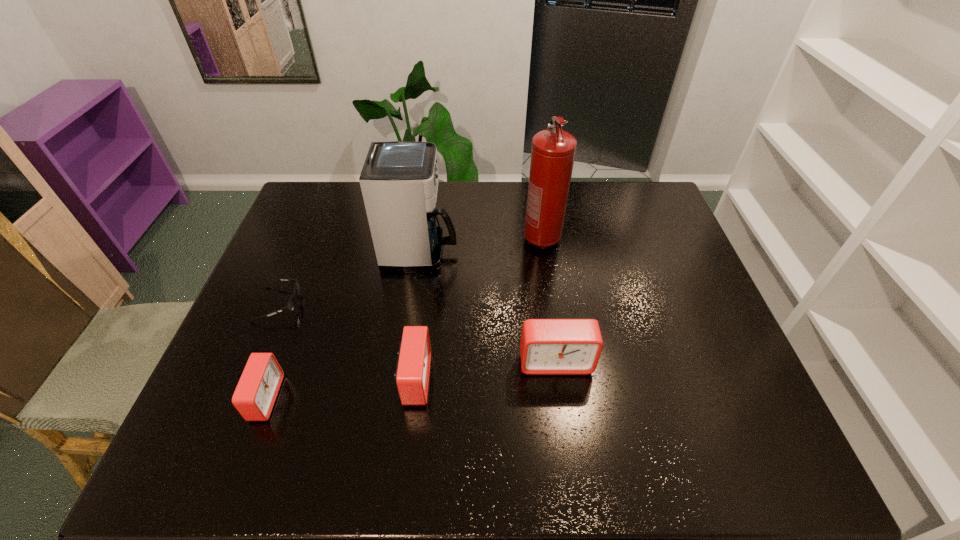
Find the location of a particular element. free location located 0.390m on the front-facing side of the second alarm clock from right to left is located at coordinates (594, 379).

Where is `vacant region located 0.090m on the front-facing side of the rightmost alarm clock`? vacant region located 0.090m on the front-facing side of the rightmost alarm clock is located at coordinates (563, 412).

The image size is (960, 540). Identify the location of vacant space positioned on the handle side the fire extinguisher. click(554, 322).

Locate an element on the screen. The height and width of the screenshot is (540, 960). free space located on the front panel of the second tallest object is located at coordinates (525, 252).

Locate an element on the screen. free space located 0.210m on the front-facing side of the sunglasses is located at coordinates (376, 304).

Where is `object that is at the far edge`? object that is at the far edge is located at coordinates (553, 151).

The height and width of the screenshot is (540, 960). In order to click on alarm clock positioned at the left edge in this screenshot , I will do `click(254, 397)`.

You are a GUI agent. You are given a task and a screenshot of the screen. Output one action in this format:
    pyautogui.click(x=<x>, y=<y>)
    Task: Click on the sunglasses that is at the left edge
    
    Given the screenshot: What is the action you would take?
    pyautogui.click(x=291, y=304)

This screenshot has width=960, height=540. What are the coordinates of `object that is positioned at the near left corner` in the screenshot? It's located at (254, 397).

In the image, there is a desktop. Where is `vacant space at the far edge`? The width and height of the screenshot is (960, 540). vacant space at the far edge is located at coordinates (445, 210).